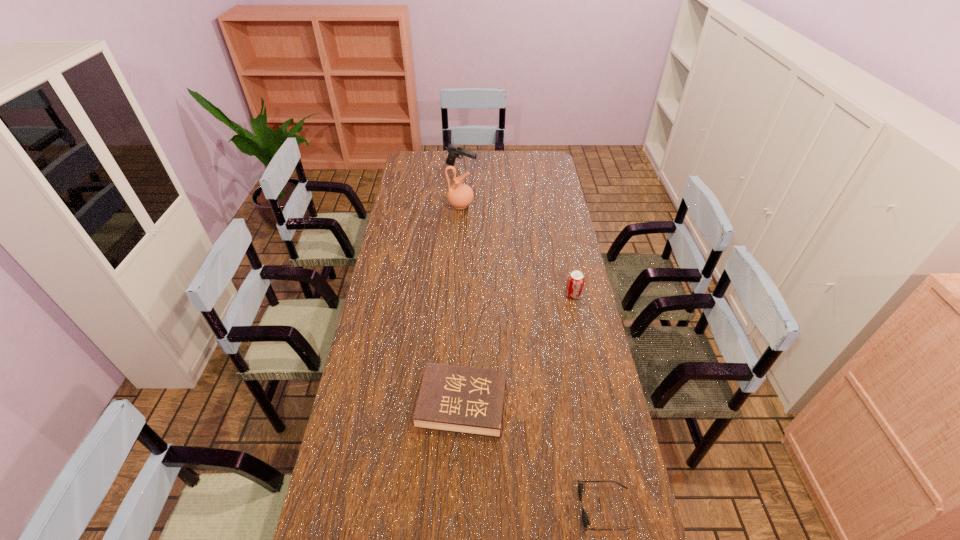
Find the location of a particular element. The height and width of the screenshot is (540, 960). free space at the far edge of the desktop is located at coordinates point(509,156).

Image resolution: width=960 pixels, height=540 pixels. In order to click on vacant space at the left edge of the desktop in this screenshot , I will do `click(427, 193)`.

This screenshot has width=960, height=540. I want to click on free point at the right edge, so click(610, 472).

The image size is (960, 540). What are the coordinates of `vacant space at the far left corner of the desktop` in the screenshot? It's located at (424, 167).

Where is `vacant space at the far right corner`? vacant space at the far right corner is located at coordinates (524, 153).

I want to click on free space between the fourth shortest object and the third tallest object, so click(x=517, y=232).

Where is `free area in between the shortest object and the gun`? free area in between the shortest object and the gun is located at coordinates (534, 339).

Locate an element on the screen. The height and width of the screenshot is (540, 960). free space between the tallest object and the hardback book is located at coordinates (461, 305).

Where is `vacant region between the farthest object and the third shortest object`? vacant region between the farthest object and the third shortest object is located at coordinates (517, 232).

What are the coordinates of `empty space that is in between the shortest object and the fourth shortest object` in the screenshot? It's located at coord(534,339).